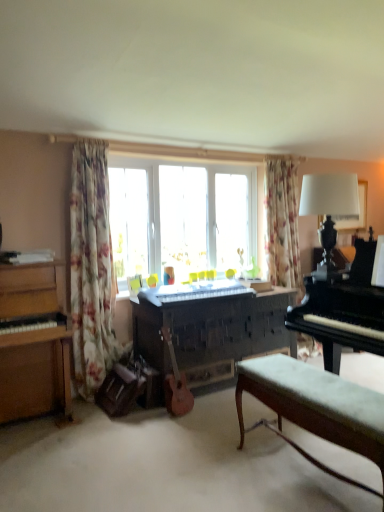
This screenshot has width=384, height=512. Find the location of `vacant space behind velvet green bench at lower right`. vacant space behind velvet green bench at lower right is located at coordinates (275, 437).